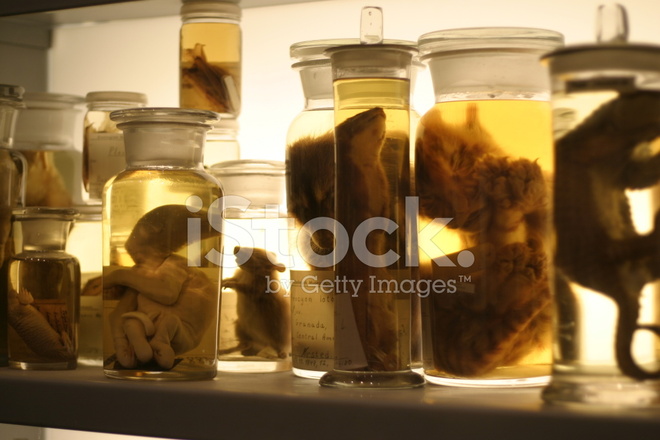
Locate an element on the screen. The image size is (660, 440). wall is located at coordinates (313, 17).